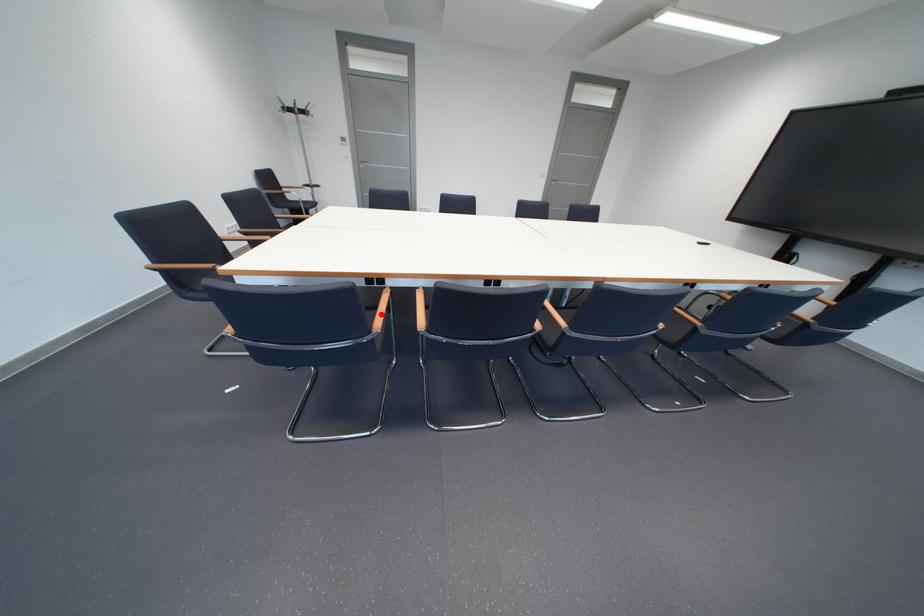
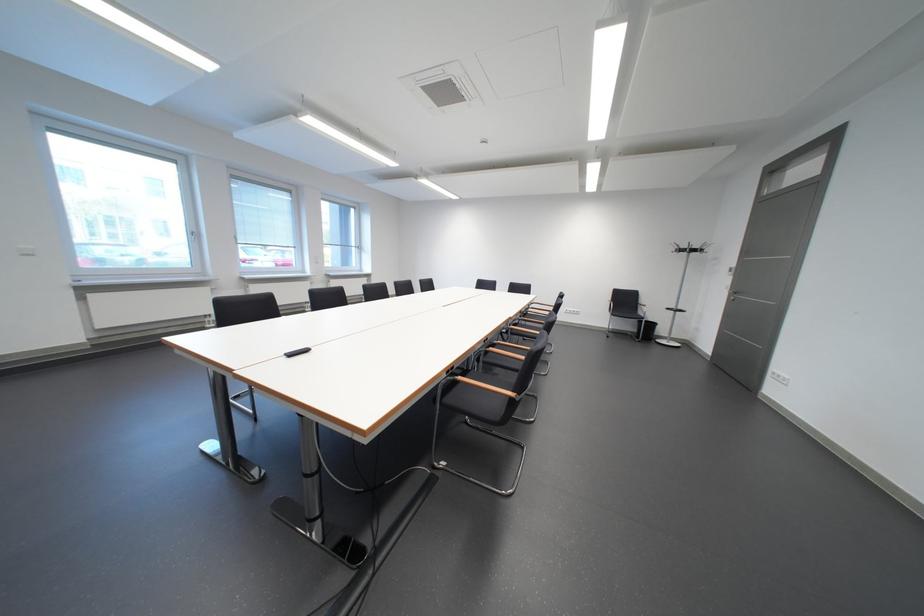
Question: I am providing you with two images of the same scene from different viewpoints. A red point is marked on the first image. At the location where the point appears in image 1, is it still visible in image 2?

Choices:
 (A) Yes
 (B) No

Answer: (B)